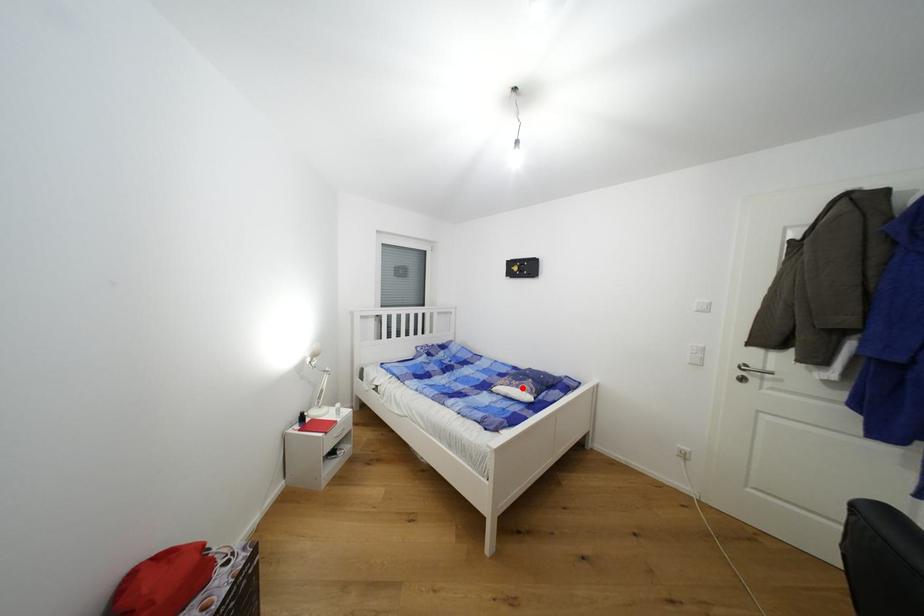
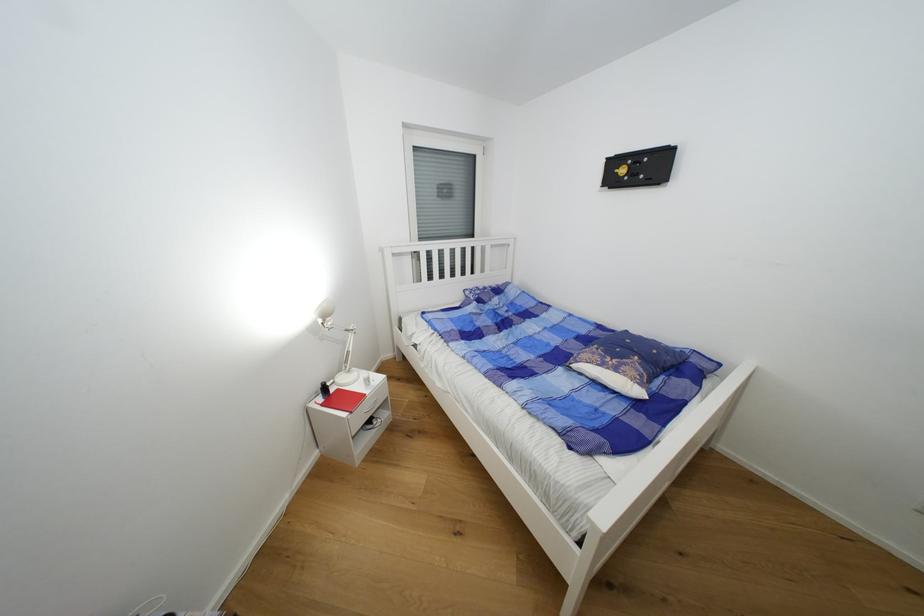
Question: I am providing you with two images of the same scene from different viewpoints. In image1, a red point is highlighted. Considering the same 3D point in image2, which of the following is correct?

Choices:
 (A) It is closer
 (B) It is farther

Answer: (B)